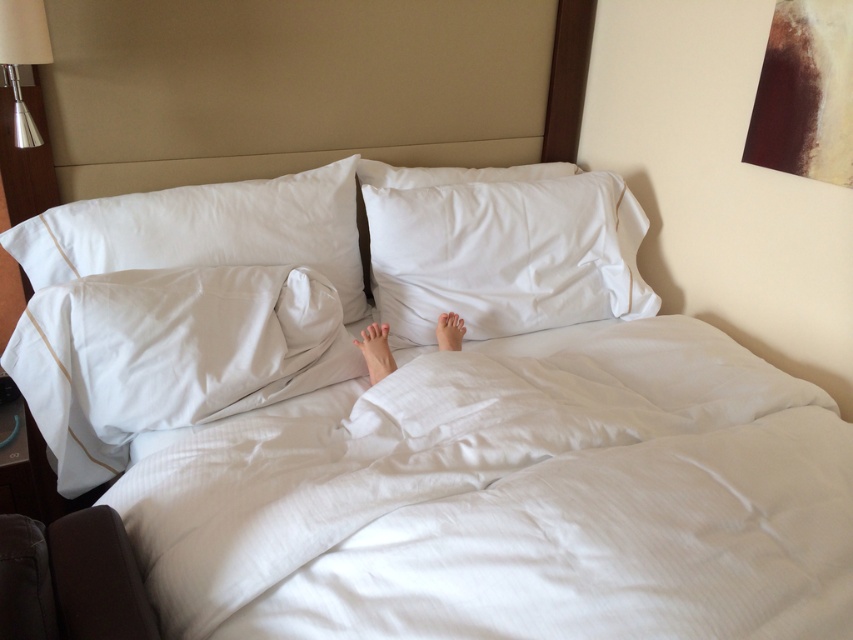
You are a interior designer planning to place a new decorative item in the bedroom. You have a small statue that is the same size as the metallic silver lampshade at upper left. Can the statue fit in the space where the white soft pillow at center is currently located?

The white soft pillow at center is bigger than the metallic silver lampshade at upper left. Since the statue is the same size as the lampshade, it can fit in the space where the white soft pillow at center is currently located, as the pillow takes up more space.

You are a housekeeper entering the room to make the bed. You see the white textured pillow at lower left and the skinny white feet at center. Which object is closer to the foot of the bed?

The white textured pillow at lower left is positioned under the skinny white feet at center, so the white textured pillow at lower left is closer to the foot of the bed.

You are a delivery robot that is 0.5 meters wide. You need to deliver a package to the bedside table where the metallic silver lampshade at upper left is located. The path between you and the bedside table is blocked by the white soft pillow at center. Can you navigate around the pillow to reach the bedside table?

The distance between the white soft pillow at center and the metallic silver lampshade at upper left is 1.08 meters. Since the robot is 0.5 meters wide, it can navigate around the pillow as there is sufficient space between them to maneuver.